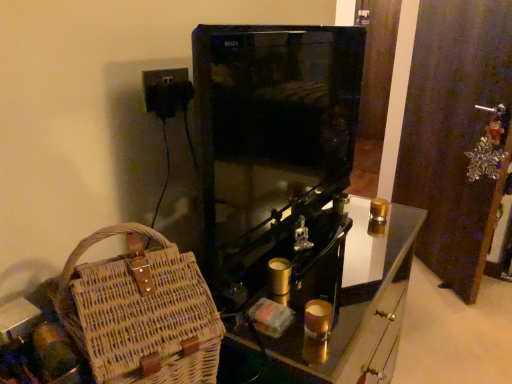
Question: Does woven straw bag at lower left have a greater height compared to woven wood basket at lower left?

Choices:
 (A) yes
 (B) no

Answer: (B)

Question: From the image's perspective, does woven straw bag at lower left appear lower than woven wood basket at lower left?

Choices:
 (A) no
 (B) yes

Answer: (A)

Question: From a real-world perspective, is woven straw bag at lower left under woven wood basket at lower left?

Choices:
 (A) yes
 (B) no

Answer: (B)

Question: Is the position of woven straw bag at lower left more distant than that of woven wood basket at lower left?

Choices:
 (A) yes
 (B) no

Answer: (B)

Question: Is woven straw bag at lower left completely or partially outside of woven wood basket at lower left?

Choices:
 (A) yes
 (B) no

Answer: (A)

Question: From a real-world perspective, is woven straw bag at lower left on top of woven wood basket at lower left?

Choices:
 (A) yes
 (B) no

Answer: (A)

Question: Is woven straw bag at lower left facing away from metallic brown door at right?

Choices:
 (A) yes
 (B) no

Answer: (B)

Question: Does woven straw bag at lower left appear on the right side of metallic brown door at right?

Choices:
 (A) no
 (B) yes

Answer: (A)

Question: Is woven straw bag at lower left smaller than metallic brown door at right?

Choices:
 (A) yes
 (B) no

Answer: (A)

Question: Considering the relative sizes of woven straw bag at lower left and metallic brown door at right in the image provided, is woven straw bag at lower left wider than metallic brown door at right?

Choices:
 (A) yes
 (B) no

Answer: (A)

Question: From a real-world perspective, is woven straw bag at lower left located beneath metallic brown door at right?

Choices:
 (A) yes
 (B) no

Answer: (B)

Question: Does woven straw bag at lower left have a lesser height compared to metallic brown door at right?

Choices:
 (A) yes
 (B) no

Answer: (A)

Question: Could you tell me if metallic brown door at right is facing woven wood basket at lower left?

Choices:
 (A) yes
 (B) no

Answer: (B)